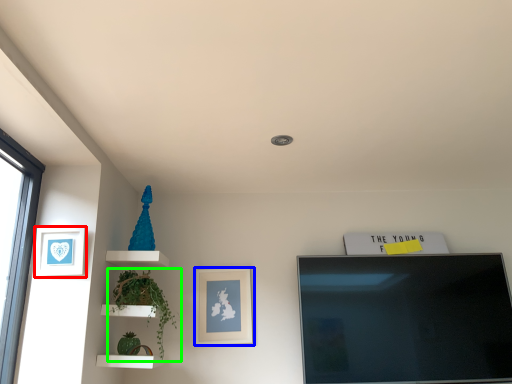
Question: Based on their relative distances, which object is nearer to picture frame (highlighted by a red box)? Choose from picture frame (highlighted by a blue box) and plant (highlighted by a green box).

Choices:
 (A) picture frame
 (B) plant

Answer: (B)